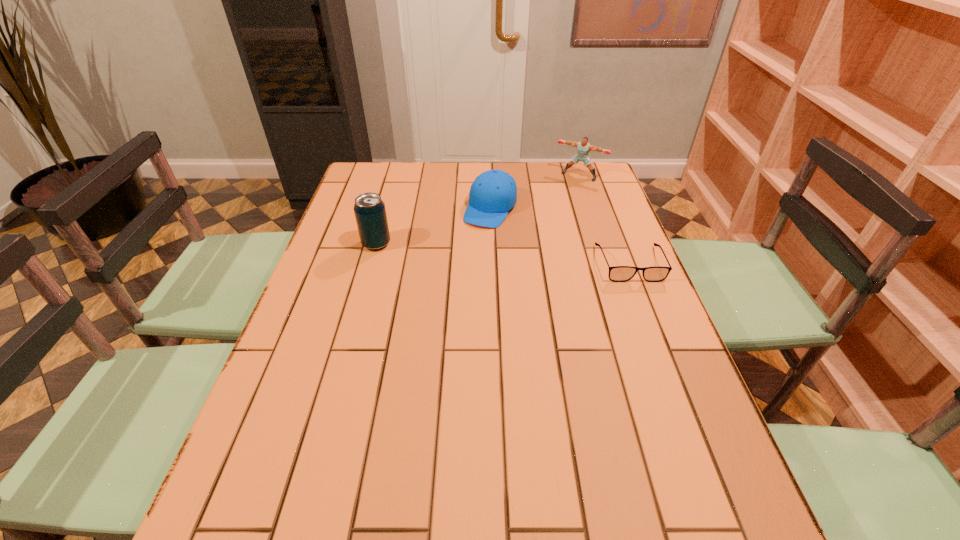
Where is `the leftmost object`? the leftmost object is located at coordinates (369, 209).

Locate an element on the screen. The image size is (960, 540). spectacles is located at coordinates (616, 273).

Image resolution: width=960 pixels, height=540 pixels. Find the location of `puncher`. puncher is located at coordinates (584, 147).

The image size is (960, 540). Identify the location of the second shortest object. (493, 193).

Where is `cap`? The width and height of the screenshot is (960, 540). cap is located at coordinates (493, 193).

Find the location of a particular element. Image resolution: width=960 pixels, height=540 pixels. free spot located on the right of the leftmost object is located at coordinates (510, 244).

Where is `blank space located on the front-facing side of the spectacles`? This screenshot has height=540, width=960. blank space located on the front-facing side of the spectacles is located at coordinates (685, 406).

I want to click on vacant area situated 0.130m on the front-facing side of the puncher, so click(557, 199).

This screenshot has height=540, width=960. I want to click on vacant area situated 0.400m on the front-facing side of the puncher, so click(x=524, y=242).

Identify the location of vacant space located on the front-facing side of the puncher. The width and height of the screenshot is (960, 540). (555, 202).